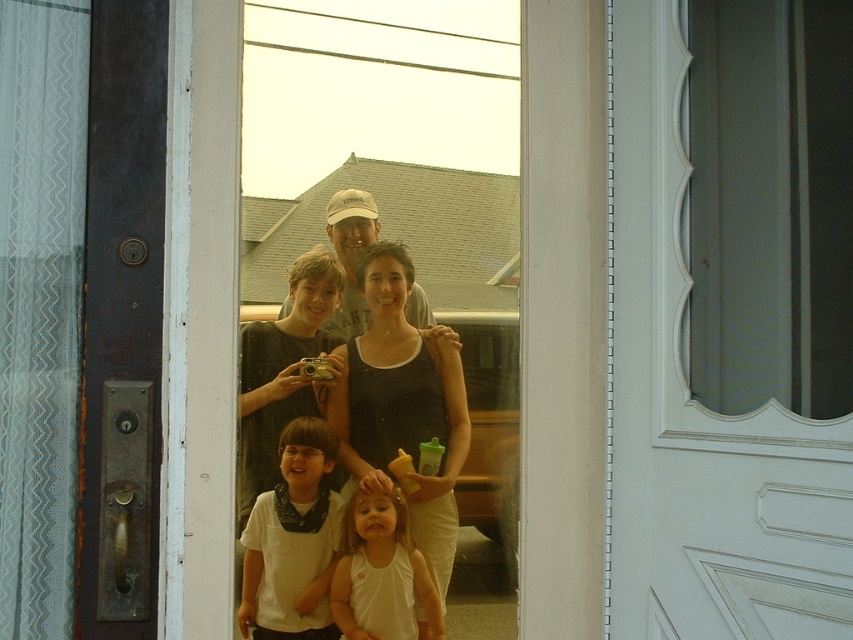
Question: Which of the following is the farthest from the observer?

Choices:
 (A) (257, 632)
 (B) (254, 282)
 (C) (349, 284)
 (D) (347, 566)

Answer: (C)

Question: Is black matte tank top at center thinner than matte white tank top at center?

Choices:
 (A) yes
 (B) no

Answer: (A)

Question: Which of the following is the closest to the observer?

Choices:
 (A) transparent glass screen door at center
 (B) black matte tank top at center

Answer: (A)

Question: Is transparent glass door at center positioned before white matte shirt at center?

Choices:
 (A) no
 (B) yes

Answer: (B)

Question: Is black matte tank top at center below white matte tank top at center?

Choices:
 (A) no
 (B) yes

Answer: (A)

Question: Which object appears farthest from the camera in this image?

Choices:
 (A) black matte tank top at center
 (B) matte white tank top at center
 (C) transparent glass screen door at center

Answer: (A)